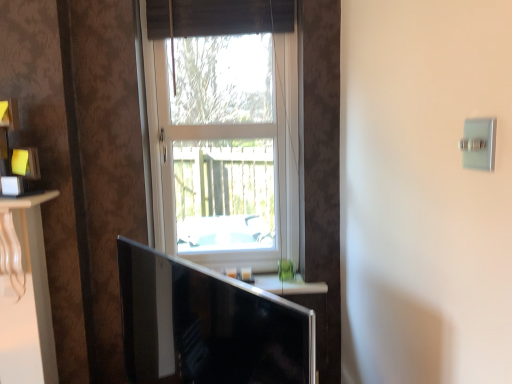
Question: In terms of height, does brown woven curtain at upper center look taller or shorter compared to black glossy monitor at lower center?

Choices:
 (A) tall
 (B) short

Answer: (B)

Question: Choose the correct answer: Is brown woven curtain at upper center inside black glossy monitor at lower center or outside it?

Choices:
 (A) outside
 (B) inside

Answer: (A)

Question: Estimate the real-world distances between objects in this image. Which object is farther from the brown woven curtain at upper center?

Choices:
 (A) satin silver switch at upper right
 (B) black glossy monitor at lower center
 (C) white frame window at center

Answer: (A)

Question: Which object is the farthest from the black glossy monitor at lower center?

Choices:
 (A) brown woven curtain at upper center
 (B) satin silver switch at upper right
 (C) white frame window at center

Answer: (A)